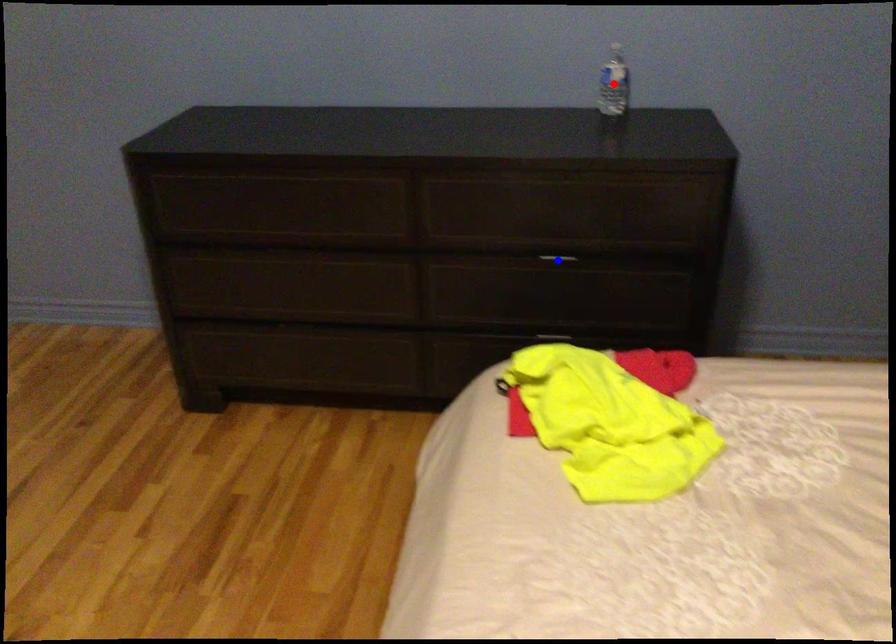
Question: Two points are marked on the image. Which point is closer to the camera?

Choices:
 (A) Blue point is closer.
 (B) Red point is closer.

Answer: (A)